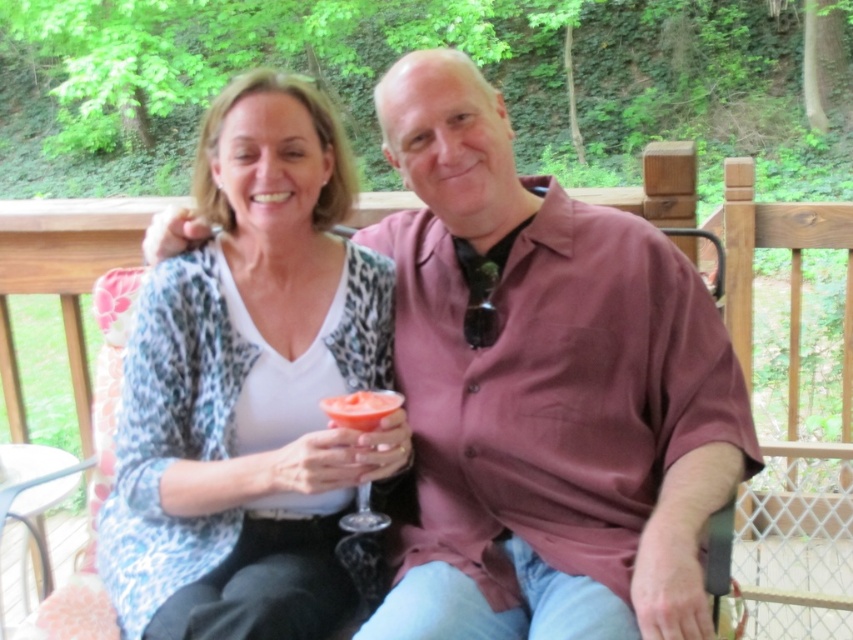
You are a photographer trying to capture a closeup of the white leopard print cardigan at center and the translucent glass at center. Which object should you focus on first if you want to start with the one closer to the camera?

The white leopard print cardigan at center is positioned on the left side of translucent glass at center, so it is closer to the camera. Focus on the white leopard print cardigan at center first.

You are standing in front of the wooden deck where the couple is sitting. You notice two points marked on the deck. The first point is at coordinates point (517, 300) and the second point is at point (347, 296). Which point is closer to you?

Point (517, 300) is in front of point (347, 296), so the first point is closer to you.

You are a photographer standing in front of the two people in the image. You need to adjust your camera to focus on the pink matte shirt at center and the white leopard print cardigan at center. Based on their positions, which item is closer to the right side of the frame?

The pink matte shirt at center is to the right of the white leopard print cardigan at center, so the pink matte shirt at center is closer to the right side of the frame.